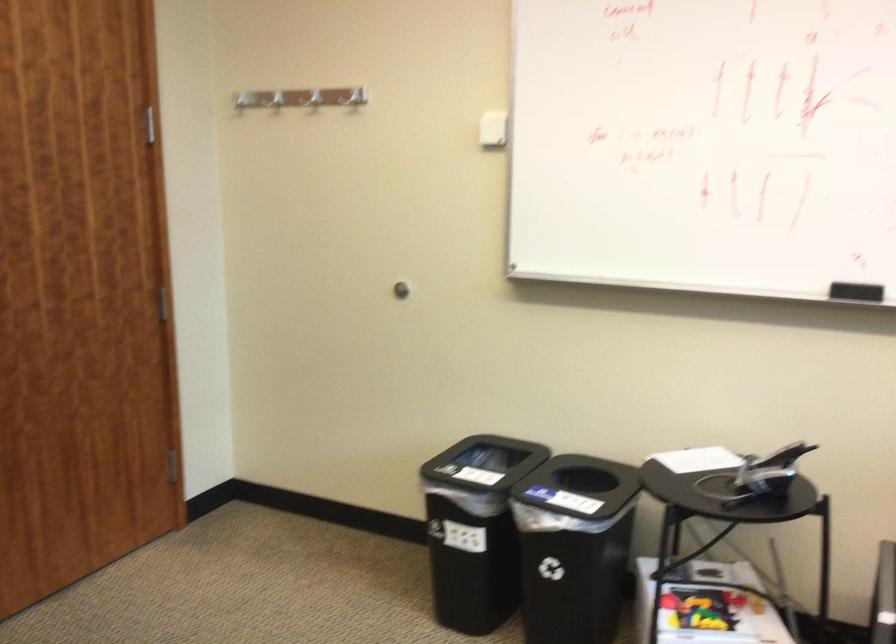
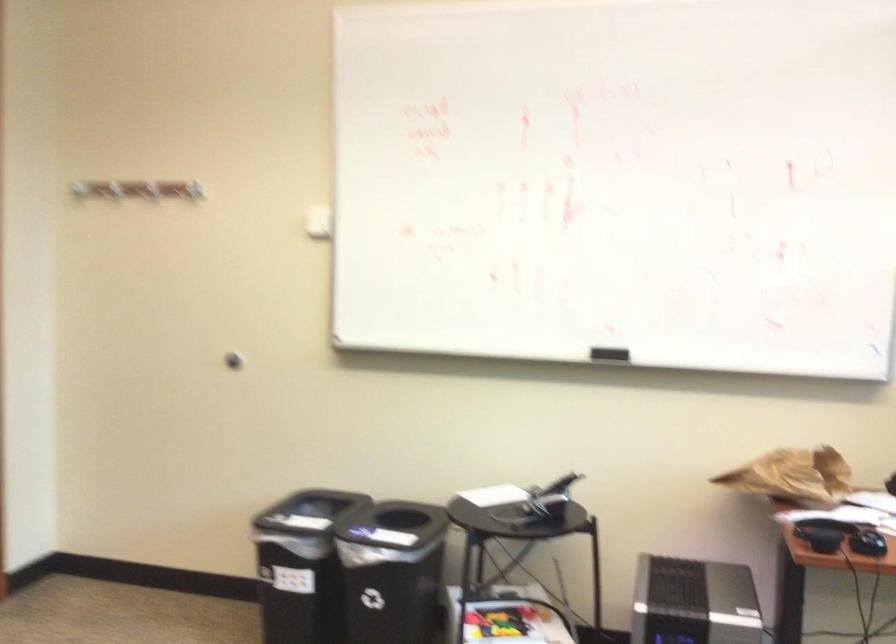
Where in the second image is the point corresponding to point 471,523 from the first image?

(300, 565)